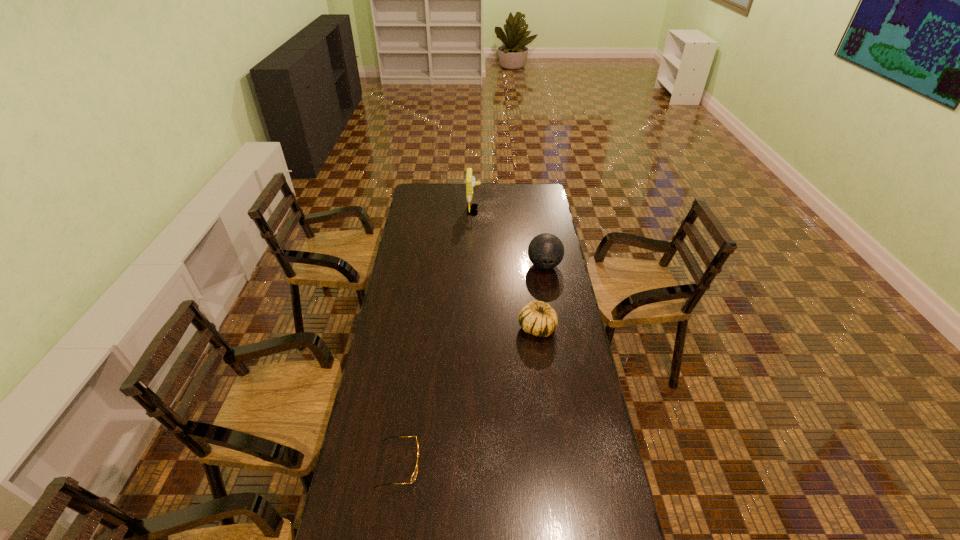
The height and width of the screenshot is (540, 960). I want to click on vacant area situated 0.070m on the back of the third tallest object, so click(x=534, y=303).

Find the location of a particular element. The image size is (960, 540). free spot located on the front-facing side of the shortest object is located at coordinates (486, 464).

Where is `object that is at the far edge`? object that is at the far edge is located at coordinates (470, 180).

The height and width of the screenshot is (540, 960). Identify the location of object present at the left edge. (414, 474).

Where is `bowling ball that is at the right edge`? bowling ball that is at the right edge is located at coordinates (545, 251).

I want to click on gourd that is positioned at the right edge, so click(x=537, y=318).

Locate an element on the screen. vacant space at the far edge is located at coordinates (490, 185).

Locate an element on the screen. This screenshot has height=540, width=960. free spot at the left edge of the desktop is located at coordinates (346, 491).

Locate an element on the screen. Image resolution: width=960 pixels, height=540 pixels. blank space at the right edge of the desktop is located at coordinates [566, 327].

This screenshot has width=960, height=540. What are the coordinates of `vacant region at the far left corner of the desktop` in the screenshot? It's located at (423, 200).